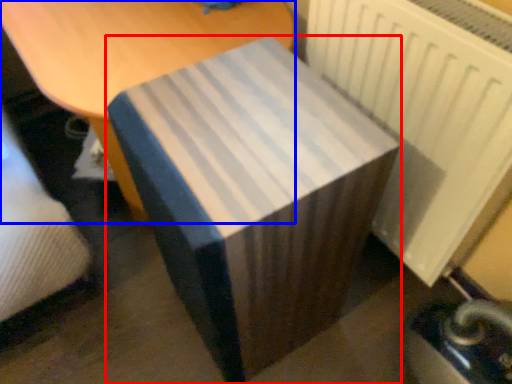
Question: Which object appears farthest to the camera in this image, table (highlighted by a red box) or furniture (highlighted by a blue box)?

Choices:
 (A) table
 (B) furniture

Answer: (B)